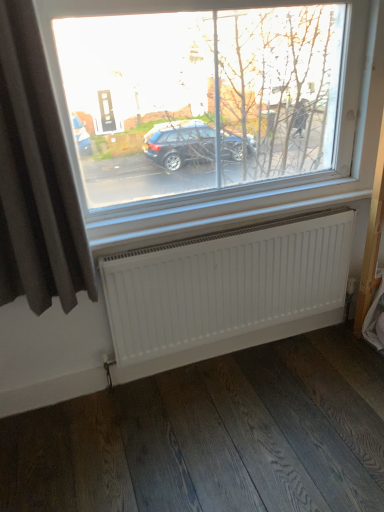
Question: Is white matte radiator at lower center next to dark grey fabric curtain at left?

Choices:
 (A) yes
 (B) no

Answer: (B)

Question: From a real-world perspective, does white matte radiator at lower center stand above dark grey fabric curtain at left?

Choices:
 (A) yes
 (B) no

Answer: (B)

Question: Does white matte radiator at lower center have a lesser width compared to dark grey fabric curtain at left?

Choices:
 (A) no
 (B) yes

Answer: (B)

Question: Does white matte radiator at lower center have a larger size compared to dark grey fabric curtain at left?

Choices:
 (A) yes
 (B) no

Answer: (B)

Question: Is dark grey fabric curtain at left a part of white matte radiator at lower center?

Choices:
 (A) no
 (B) yes

Answer: (A)

Question: Is white matte radiator at lower center oriented away from dark grey fabric curtain at left?

Choices:
 (A) no
 (B) yes

Answer: (A)

Question: Is dark grey fabric curtain at left not close to white matte radiator at lower center?

Choices:
 (A) yes
 (B) no

Answer: (B)

Question: Does dark grey fabric curtain at left have a smaller size compared to white matte radiator at lower center?

Choices:
 (A) no
 (B) yes

Answer: (A)

Question: From a real-world perspective, is dark grey fabric curtain at left on top of white matte radiator at lower center?

Choices:
 (A) yes
 (B) no

Answer: (A)

Question: Is white matte radiator at lower center at the back of dark grey fabric curtain at left?

Choices:
 (A) yes
 (B) no

Answer: (B)

Question: Would you say dark grey fabric curtain at left is outside white matte radiator at lower center?

Choices:
 (A) no
 (B) yes

Answer: (B)

Question: Does dark grey fabric curtain at left have a lesser height compared to white matte radiator at lower center?

Choices:
 (A) no
 (B) yes

Answer: (A)

Question: From a real-world perspective, relative to white matte radiator at lower center, is dark grey fabric curtain at left vertically above or below?

Choices:
 (A) above
 (B) below

Answer: (A)